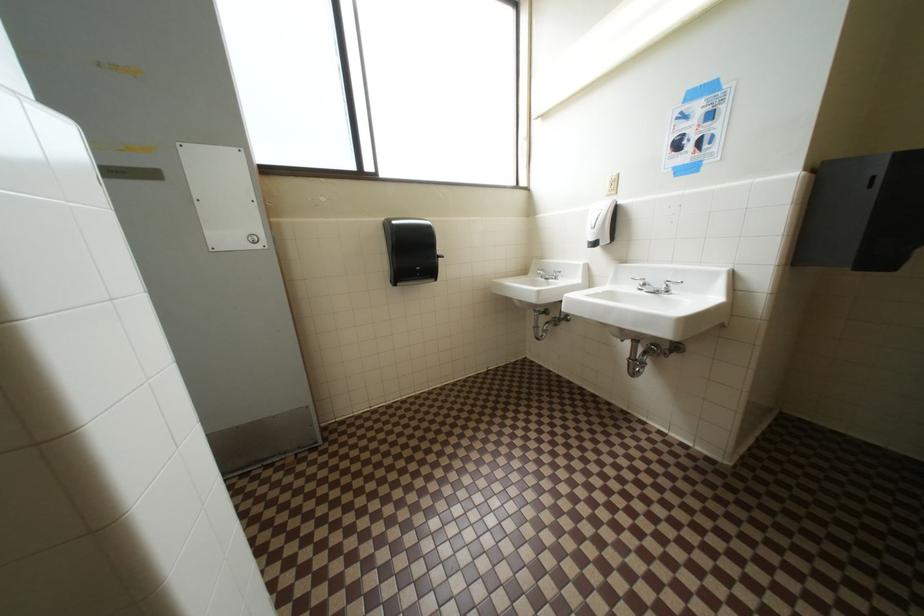
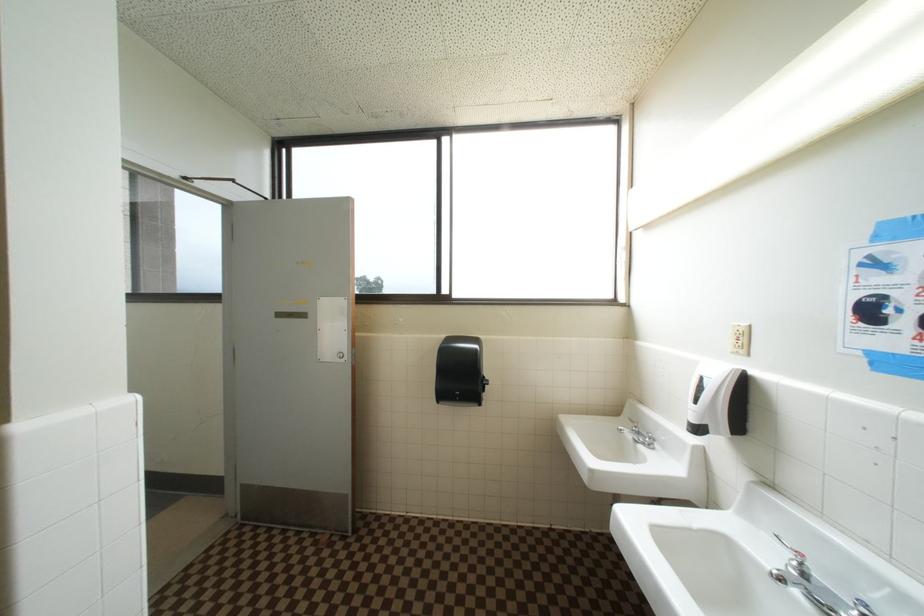
Question: Based on the continuous images, in which direction is the camera rotating? Reply with the corresponding letter.

Choices:
 (A) Left
 (B) Right
 (C) Up
 (D) Down

Answer: (A)